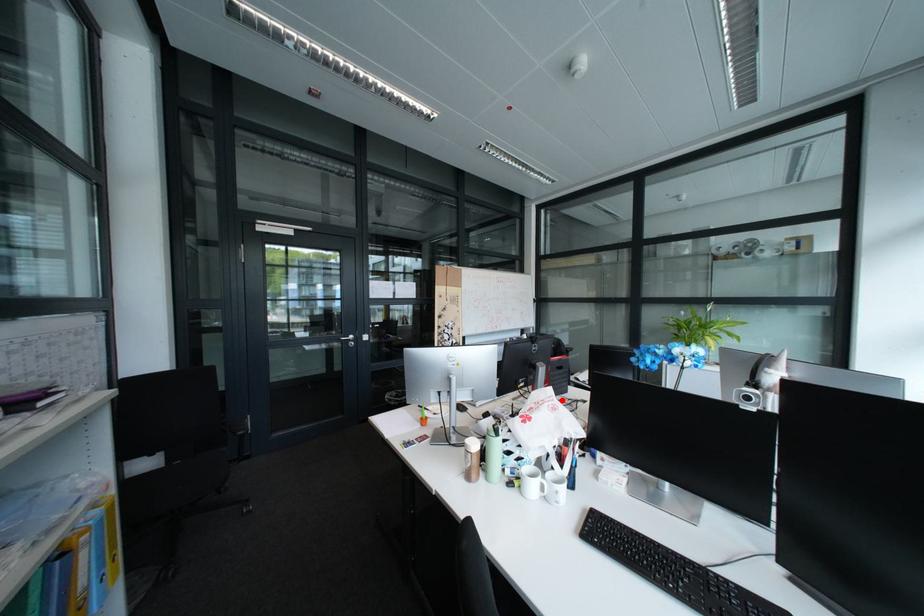
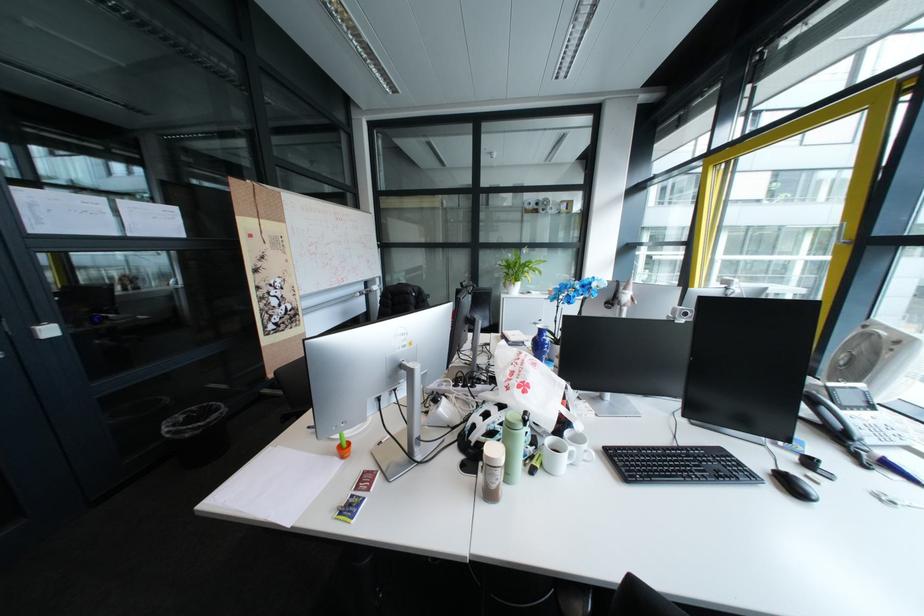
Where in the second image is the point corresponding to the highlighted location from the first image?

(536, 357)